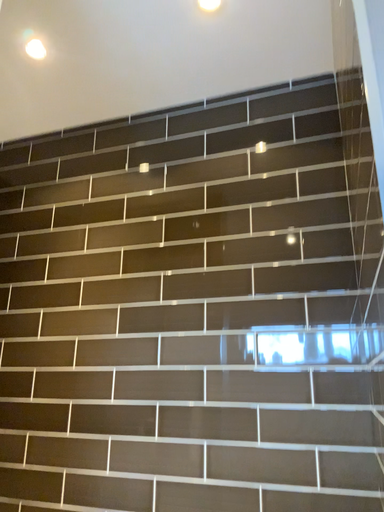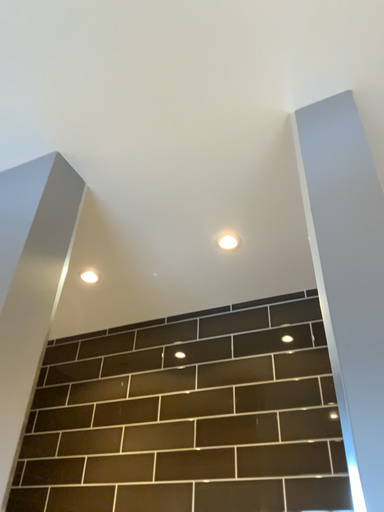
Question: How did the camera likely rotate when shooting the video?

Choices:
 (A) rotated downward
 (B) rotated upward

Answer: (B)